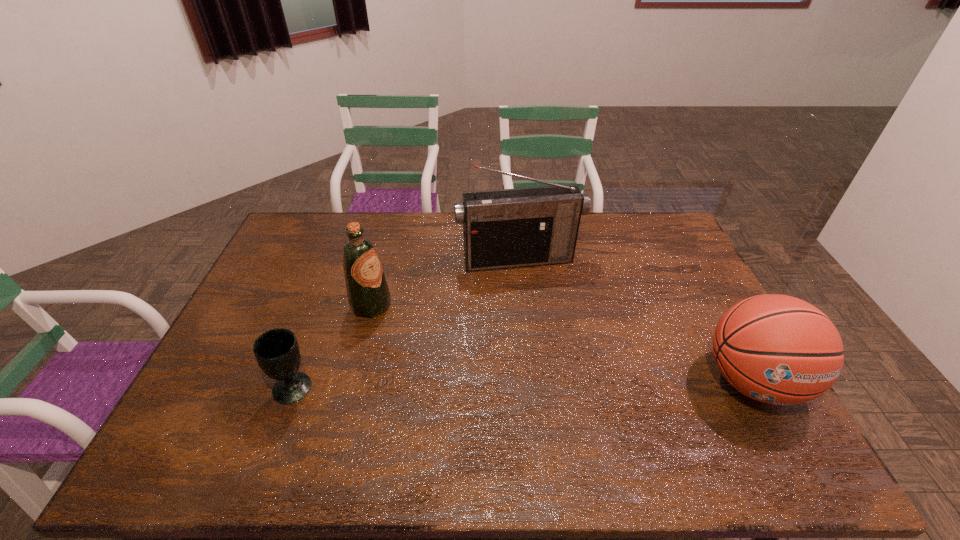
I want to click on vacant space on the desktop that is between the leftmost object and the rightmost object and is positioned on the front-facing side of the second object from left to right, so click(522, 384).

The width and height of the screenshot is (960, 540). I want to click on free spot on the desktop that is between the chalice and the rightmost object and is positioned on the front-facing side of the farthest object, so click(555, 384).